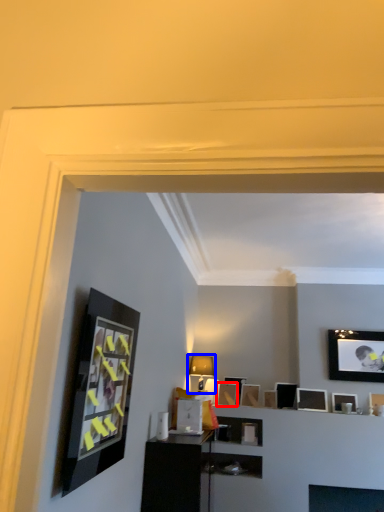
Question: Among these objects, which one is nearest to the camera, picture frame (highlighted by a red box) or lamp (highlighted by a blue box)?

Choices:
 (A) picture frame
 (B) lamp

Answer: (B)